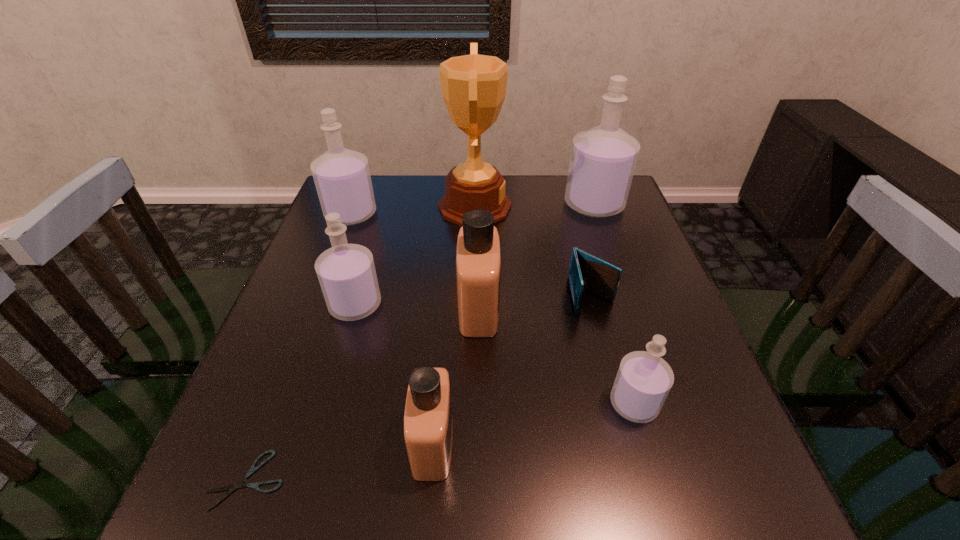
The width and height of the screenshot is (960, 540). Find the location of `vacant area between the shears and the smaller beige perfume`. vacant area between the shears and the smaller beige perfume is located at coordinates 340,461.

Identify the location of unoccupied area between the wallet and the nearest purple perfume. (612, 350).

You are a GUI agent. You are given a task and a screenshot of the screen. Output one action in this format:
    pyautogui.click(x=<x>, y=<y>)
    Task: Click on the free space between the shears and the farther beige perfume
    This screenshot has height=540, width=960.
    Given the screenshot: What is the action you would take?
    pyautogui.click(x=363, y=394)

Identify the location of object identified as the third closest to the bigger beige perfume. (346, 272).

Identify which object is located as the third nearest to the blue wallet. Please provide its 2D coordinates. Your answer should be formatted as a tuple, i.e. [(x, y)], where the tuple contains the x and y coordinates of a point satisfying the conditions above.

[(473, 86)]

Select which perfume is the closest to the bigger beige perfume. Please provide its 2D coordinates. Your answer should be formatted as a tuple, i.e. [(x, y)], where the tuple contains the x and y coordinates of a point satisfying the conditions above.

[(428, 425)]

This screenshot has width=960, height=540. Find the location of `perfume that is the fifth closest to the third farthest purple perfume`. perfume that is the fifth closest to the third farthest purple perfume is located at coordinates (603, 159).

This screenshot has height=540, width=960. Find the location of `the second closest purple perfume to the third farthest purple perfume`. the second closest purple perfume to the third farthest purple perfume is located at coordinates (643, 381).

Locate an element on the screen. purple perfume that stands as the closest to the smaller beige perfume is located at coordinates (346, 272).

Find the location of `vacant space that satisfies the following two spatial constraints: 1. on the back side of the biggest purple perfume; 2. on the right side of the fifth shortest perfume`. vacant space that satisfies the following two spatial constraints: 1. on the back side of the biggest purple perfume; 2. on the right side of the fifth shortest perfume is located at coordinates (354, 205).